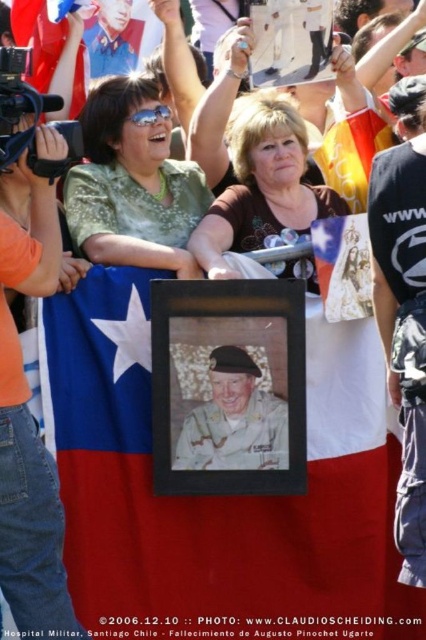
Who is more distant from viewer, (143, 170) or (54, 42)?

Point (54, 42)

Is green textured blouse at upper center positioned at the back of red fabric flag at upper left?

No, it is not.

This screenshot has width=426, height=640. In order to click on green textured blouse at upper center in this screenshot , I will do `click(132, 182)`.

Does green textured blouse at upper center have a larger size compared to brown matte shirt at center?

Incorrect, green textured blouse at upper center is not larger than brown matte shirt at center.

Between green textured blouse at upper center and brown matte shirt at center, which one has less height?

Standing shorter between the two is brown matte shirt at center.

Which is behind, point (183, 244) or point (279, 225)?

Positioned behind is point (279, 225).

Find the location of a particular element. This screenshot has width=426, height=640. green textured blouse at upper center is located at coordinates (132, 182).

From the picture: Which is above, red fabric flag at center or blue uniform at upper left?

Positioned higher is blue uniform at upper left.

Does red fabric flag at center come in front of blue uniform at upper left?

Yes, red fabric flag at center is closer to the viewer.

Between point (374, 125) and point (123, 10), which one is positioned behind?

Positioned behind is point (123, 10).

Locate an element on the screen. The width and height of the screenshot is (426, 640). red fabric flag at center is located at coordinates (353, 154).